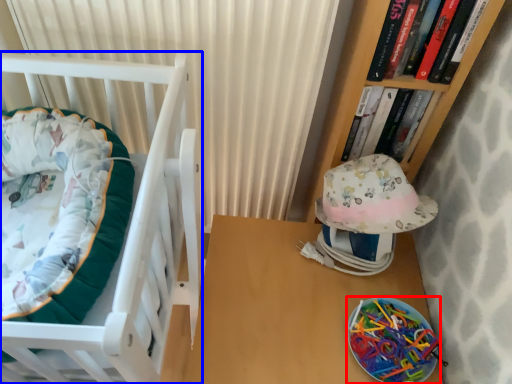
Question: Which object is closer to the camera taking this photo, glass plate (highlighted by a red box) or furniture (highlighted by a blue box)?

Choices:
 (A) glass plate
 (B) furniture

Answer: (B)